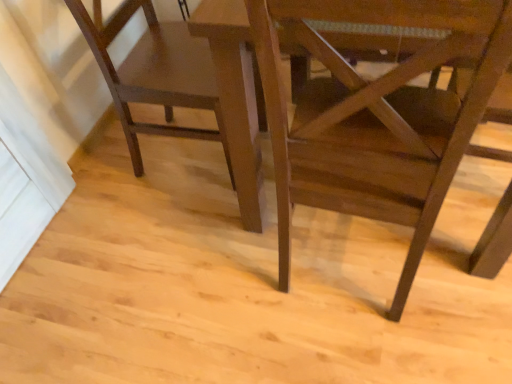
Image resolution: width=512 pixels, height=384 pixels. I want to click on matte brown chair at lower right, positioned as the 2th chair in left-to-right order, so click(x=376, y=116).

What is the approximate height of matte brown chair at lower right, the 1th chair from the right?

matte brown chair at lower right, the 1th chair from the right, is 37.13 inches in height.

Image resolution: width=512 pixels, height=384 pixels. Describe the element at coordinates (376, 116) in the screenshot. I see `matte brown chair at lower right, positioned as the 2th chair in left-to-right order` at that location.

Identify the location of matte brown chair at left, the 1th chair viewed from the left. This screenshot has height=384, width=512. (154, 73).

The image size is (512, 384). What do you see at coordinates (154, 73) in the screenshot?
I see `matte brown chair at left, the 1th chair viewed from the left` at bounding box center [154, 73].

Image resolution: width=512 pixels, height=384 pixels. Identify the location of matte brown chair at lower right, the 1th chair from the right. (376, 116).

In the image, is matte brown chair at left, the 1th chair viewed from the left, on the left side or the right side of matte brown chair at lower right, positioned as the 2th chair in left-to-right order?

matte brown chair at left, the 1th chair viewed from the left, is positioned on matte brown chair at lower right, positioned as the 2th chair in left-to-right order,'s left side.

Which object is closer to the camera, matte brown chair at left, arranged as the 2th chair when viewed from the right, or matte brown chair at lower right, positioned as the 2th chair in left-to-right order?

matte brown chair at lower right, positioned as the 2th chair in left-to-right order, is in front.

Considering the points (203, 72) and (449, 108), which point is in front, point (203, 72) or point (449, 108)?

The point (449, 108) is in front.

From the image's perspective, between matte brown chair at left, arranged as the 2th chair when viewed from the right, and matte brown chair at lower right, the 1th chair from the right, which one is located above?

matte brown chair at left, arranged as the 2th chair when viewed from the right, appears higher in the image.

From the picture: From a real-world perspective, is matte brown chair at left, arranged as the 2th chair when viewed from the right, above or below matte brown chair at lower right, the 1th chair from the right?

Clearly, from a real-world perspective, matte brown chair at left, arranged as the 2th chair when viewed from the right, is below matte brown chair at lower right, the 1th chair from the right.

Which of these two, matte brown chair at left, the 1th chair viewed from the left, or matte brown chair at lower right, positioned as the 2th chair in left-to-right order, is thinner?

matte brown chair at lower right, positioned as the 2th chair in left-to-right order.

Does matte brown chair at left, arranged as the 2th chair when viewed from the right, have a lesser height compared to matte brown chair at lower right, positioned as the 2th chair in left-to-right order?

Indeed, matte brown chair at left, arranged as the 2th chair when viewed from the right, has a lesser height compared to matte brown chair at lower right, positioned as the 2th chair in left-to-right order.

Considering the sizes of objects matte brown chair at left, the 1th chair viewed from the left, and matte brown chair at lower right, the 1th chair from the right, in the image provided, who is smaller, matte brown chair at left, the 1th chair viewed from the left, or matte brown chair at lower right, the 1th chair from the right,?

matte brown chair at left, the 1th chair viewed from the left, is smaller.

Looking at this image, is matte brown chair at left, the 1th chair viewed from the left, spatially inside matte brown chair at lower right, the 1th chair from the right, or outside of it?

matte brown chair at left, the 1th chair viewed from the left, is outside matte brown chair at lower right, the 1th chair from the right.

Is matte brown chair at left, the 1th chair viewed from the left, beside matte brown chair at lower right, positioned as the 2th chair in left-to-right order?

There is a gap between matte brown chair at left, the 1th chair viewed from the left, and matte brown chair at lower right, positioned as the 2th chair in left-to-right order.

Does matte brown chair at left, the 1th chair viewed from the left, turn towards matte brown chair at lower right, the 1th chair from the right?

No, matte brown chair at left, the 1th chair viewed from the left, does not turn towards matte brown chair at lower right, the 1th chair from the right.

What's the angular difference between matte brown chair at left, the 1th chair viewed from the left, and matte brown chair at lower right, positioned as the 2th chair in left-to-right order,'s facing directions?

The angular difference between matte brown chair at left, the 1th chair viewed from the left, and matte brown chair at lower right, positioned as the 2th chair in left-to-right order, is 86.1 degrees.

Measure the distance between matte brown chair at left, arranged as the 2th chair when viewed from the right, and matte brown chair at lower right, the 1th chair from the right.

16.91 inches.

At what (x,y) coordinates should I click in order to perform the action: click on chair located on the right of matte brown chair at left, the 1th chair viewed from the left. Please return your answer as a coordinate pair (x, y). The image size is (512, 384). Looking at the image, I should click on (376, 116).

Between matte brown chair at lower right, positioned as the 2th chair in left-to-right order, and matte brown chair at left, the 1th chair viewed from the left, which one appears on the right side from the viewer's perspective?

matte brown chair at lower right, positioned as the 2th chair in left-to-right order, is more to the right.

Is matte brown chair at lower right, the 1th chair from the right, behind matte brown chair at left, arranged as the 2th chair when viewed from the right?

No.

Between point (345, 0) and point (198, 72), which one is positioned in front?

The point (345, 0) is more forward.

From the image's perspective, which one is positioned higher, matte brown chair at lower right, the 1th chair from the right, or matte brown chair at left, arranged as the 2th chair when viewed from the right?

matte brown chair at left, arranged as the 2th chair when viewed from the right, is shown above in the image.

From a real-world perspective, between matte brown chair at lower right, positioned as the 2th chair in left-to-right order, and matte brown chair at left, arranged as the 2th chair when viewed from the right, who is vertically higher?

matte brown chair at lower right, positioned as the 2th chair in left-to-right order, is physically above.

Is matte brown chair at lower right, positioned as the 2th chair in left-to-right order, thinner than matte brown chair at left, arranged as the 2th chair when viewed from the right?

Correct, the width of matte brown chair at lower right, positioned as the 2th chair in left-to-right order, is less than that of matte brown chair at left, arranged as the 2th chair when viewed from the right.

Does matte brown chair at lower right, positioned as the 2th chair in left-to-right order, have a lesser height compared to matte brown chair at left, arranged as the 2th chair when viewed from the right?

Incorrect, the height of matte brown chair at lower right, positioned as the 2th chair in left-to-right order, does not fall short of that of matte brown chair at left, arranged as the 2th chair when viewed from the right.

Based on the photo, considering the sizes of objects matte brown chair at lower right, positioned as the 2th chair in left-to-right order, and matte brown chair at left, the 1th chair viewed from the left, in the image provided, who is bigger, matte brown chair at lower right, positioned as the 2th chair in left-to-right order, or matte brown chair at left, the 1th chair viewed from the left,?

With larger size is matte brown chair at lower right, positioned as the 2th chair in left-to-right order.

Is matte brown chair at left, the 1th chair viewed from the left, located within matte brown chair at lower right, the 1th chair from the right?

Definitely not — matte brown chair at left, the 1th chair viewed from the left, is not inside matte brown chair at lower right, the 1th chair from the right.

Is matte brown chair at lower right, the 1th chair from the right, not close to matte brown chair at left, arranged as the 2th chair when viewed from the right?

They are positioned close to each other.

In the scene shown: Is matte brown chair at lower right, the 1th chair from the right, oriented away from matte brown chair at left, arranged as the 2th chair when viewed from the right?

No, matte brown chair at lower right, the 1th chair from the right,'s orientation is not away from matte brown chair at left, arranged as the 2th chair when viewed from the right.

How distant is matte brown chair at lower right, positioned as the 2th chair in left-to-right order, from matte brown chair at left, arranged as the 2th chair when viewed from the right?

matte brown chair at lower right, positioned as the 2th chair in left-to-right order, is 42.95 centimeters away from matte brown chair at left, arranged as the 2th chair when viewed from the right.

The image size is (512, 384). I want to click on chair on the right of matte brown chair at left, the 1th chair viewed from the left, so click(376, 116).

Where is `chair below the matte brown chair at lower right, the 1th chair from the right (from a real-world perspective)`? The width and height of the screenshot is (512, 384). chair below the matte brown chair at lower right, the 1th chair from the right (from a real-world perspective) is located at coordinates (154, 73).

Identify the location of chair above the matte brown chair at left, the 1th chair viewed from the left (from a real-world perspective). The image size is (512, 384). (376, 116).